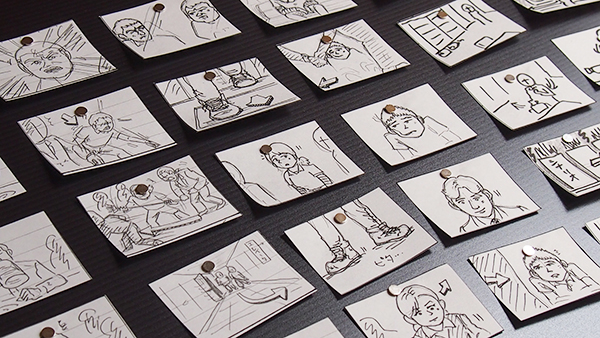
Locate instances of post it notes in the middle 2 columns in the image. Your answer should be formatted as a list of tuples, i.e. [(x1, y1), (x2, y2), ...], where each tuple contains the x and y coordinates of a point satisfying the conditions above.

[(421, 319), (369, 251), (290, 176), (226, 92), (163, 19), (531, 276), (472, 197), (407, 134), (346, 58), (291, 10)]